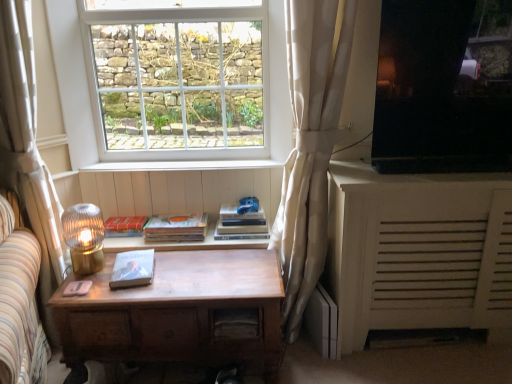
This screenshot has width=512, height=384. I want to click on vacant space to the left of matte white paperback book at center, marked as the 1th paperback book in a front-to-back arrangement, so click(x=96, y=276).